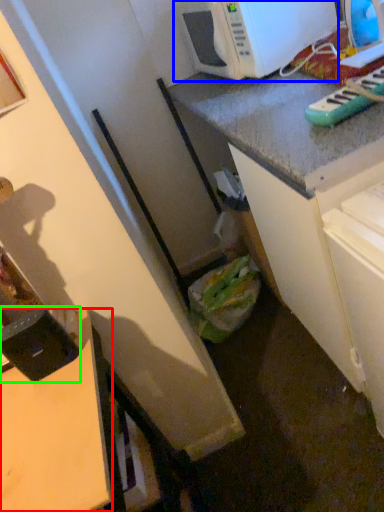
Question: Which object is the farthest from desk (highlighted by a red box)? Choose among these: microwave oven (highlighted by a blue box) or appliance (highlighted by a green box).

Choices:
 (A) microwave oven
 (B) appliance

Answer: (A)